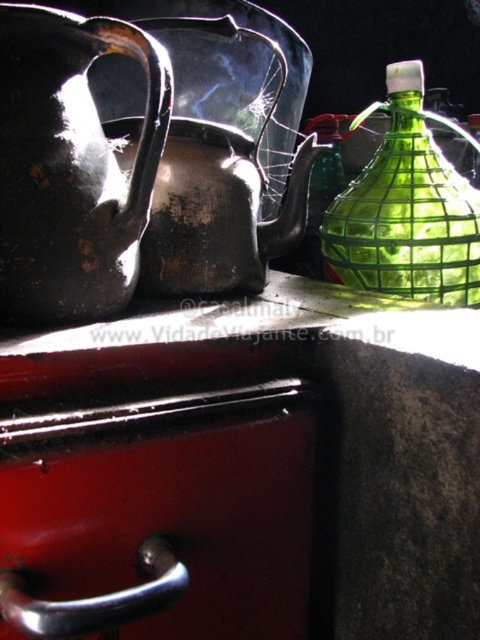
Between metallic red drawer at lower left and shiny metallic teapot at upper center, which one has more height?

shiny metallic teapot at upper center

How much distance is there between metallic red drawer at lower left and shiny metallic teapot at upper center?

metallic red drawer at lower left and shiny metallic teapot at upper center are 16.14 inches apart from each other.

Between point (142, 472) and point (195, 38), which one is positioned behind?

Point (195, 38)

Where is `metallic red drawer at lower left`? This screenshot has width=480, height=640. metallic red drawer at lower left is located at coordinates (157, 515).

Between point (268, 49) and point (369, 269), which one is positioned behind?

The point (268, 49) is more distant.

Between shiny metallic teapot at upper center and green glass bottle at upper right, which one has more height?

A: With more height is shiny metallic teapot at upper center.

The width and height of the screenshot is (480, 640). Identify the location of shiny metallic teapot at upper center. (218, 164).

You are a GUI agent. You are given a task and a screenshot of the screen. Output one action in this format:
    pyautogui.click(x=<x>, y=<y>)
    Task: Click on the metallic red drawer at lower left
    The width and height of the screenshot is (480, 640).
    Given the screenshot: What is the action you would take?
    pyautogui.click(x=157, y=515)

Is metallic red drawer at lower left bigger than glossy ceramic jug at upper left?

Indeed, metallic red drawer at lower left has a larger size compared to glossy ceramic jug at upper left.

Between point (19, 433) and point (41, 74), which one is positioned in front?

Positioned in front is point (19, 433).

The height and width of the screenshot is (640, 480). Identify the location of metallic red drawer at lower left. (157, 515).